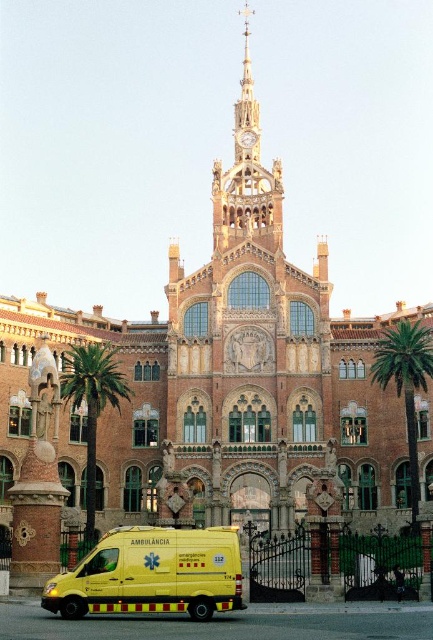
Is yellow matte ambulance at lower center positioned behind green leafy palm tree at right?

No, it is not.

In the scene shown: Which is more to the right, yellow matte ambulance at lower center or green leafy palm tree at right?

green leafy palm tree at right is more to the right.

Who is more forward, (232,545) or (387,371)?

Point (232,545) is in front.

Find the location of a particular element. This screenshot has height=640, width=433. yellow matte ambulance at lower center is located at coordinates (152, 573).

Between point (93, 444) and point (403, 372), which one is positioned behind?

The point (403, 372) is behind.

Can you confirm if green leafy palm tree at left is shorter than green leafy palm tree at right?

Yes, green leafy palm tree at left is shorter than green leafy palm tree at right.

Where is `green leafy palm tree at left`? Image resolution: width=433 pixels, height=640 pixels. green leafy palm tree at left is located at coordinates (91, 403).

Does yellow matte ambulance at lower center have a larger size compared to green leafy palm tree at left?

No, yellow matte ambulance at lower center is not bigger than green leafy palm tree at left.

Which is behind, point (165, 541) or point (106, 376)?

Point (106, 376)

Which is in front, point (226, 531) or point (118, 397)?

Positioned in front is point (226, 531).

This screenshot has width=433, height=640. What are the coordinates of `yellow matte ambulance at lower center` in the screenshot? It's located at (152, 573).